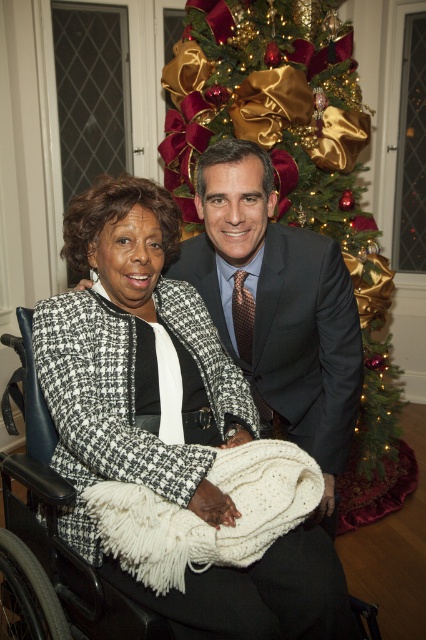
Question: Can you confirm if gold shiny tinsel at upper center is positioned to the left of black plastic wheelchair at lower left?

Choices:
 (A) no
 (B) yes

Answer: (A)

Question: Which point is farther to the camera?

Choices:
 (A) gold shiny tinsel at upper center
 (B) black plastic wheelchair at lower left

Answer: (A)

Question: Is gold shiny tinsel at upper center above black plastic wheelchair at lower left?

Choices:
 (A) no
 (B) yes

Answer: (B)

Question: Which object is closer to the camera taking this photo?

Choices:
 (A) black plastic wheelchair at lower left
 (B) gold shiny tinsel at upper center

Answer: (A)

Question: Does gold shiny tinsel at upper center have a smaller size compared to black plastic wheelchair at lower left?

Choices:
 (A) yes
 (B) no

Answer: (B)